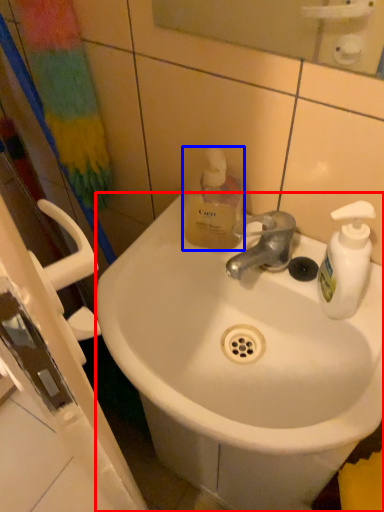
Question: Which object is closer to the camera taking this photo, sink (highlighted by a red box) or bottle (highlighted by a blue box)?

Choices:
 (A) sink
 (B) bottle

Answer: (A)